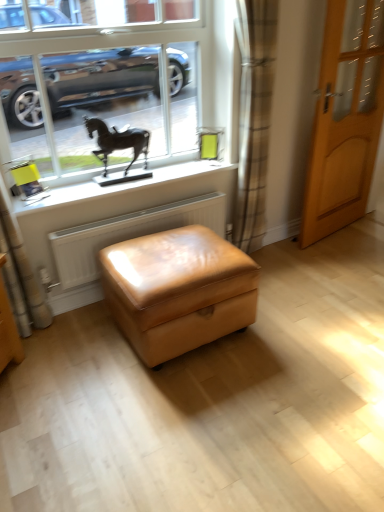
Image resolution: width=384 pixels, height=512 pixels. I want to click on free space above leather ottoman at center (from a real-world perspective), so click(x=173, y=254).